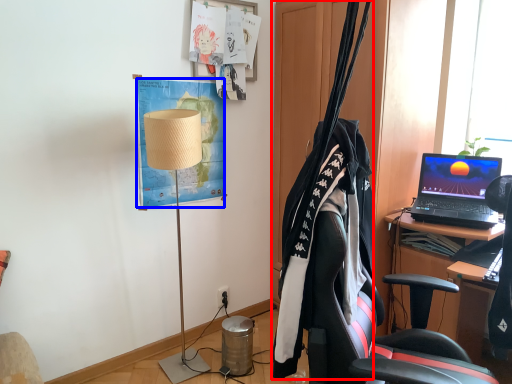
Question: Which object appears farthest to the camera in this image, clothesline (highlighted by a red box) or poster (highlighted by a blue box)?

Choices:
 (A) clothesline
 (B) poster

Answer: (B)